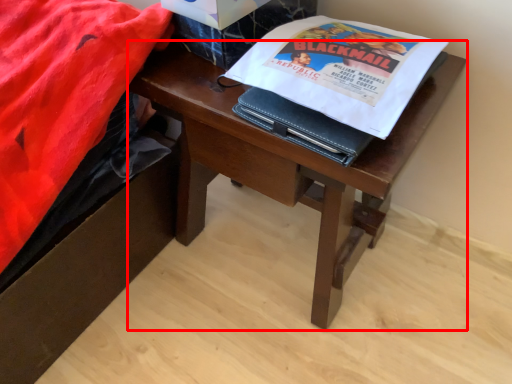
Question: From the image's perspective, where is desk (annotated by the red box) located in relation to paperback book in the image?

Choices:
 (A) below
 (B) above

Answer: (A)